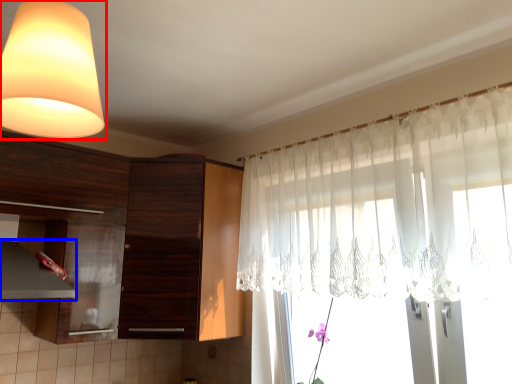
Question: Among these objects, which one is farthest to the camera, lamp (highlighted by a red box) or exhaust hood (highlighted by a blue box)?

Choices:
 (A) lamp
 (B) exhaust hood

Answer: (B)